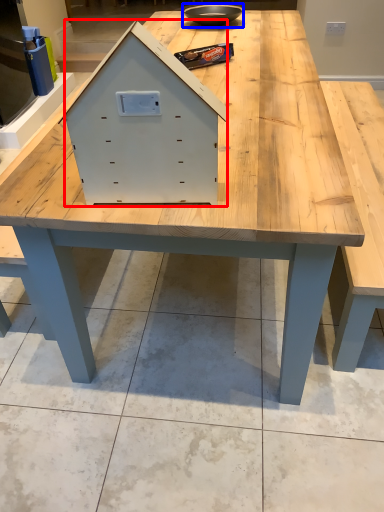
Question: Which object appears closest to the camera in this image, drawer (highlighted by a red box) or bowl (highlighted by a blue box)?

Choices:
 (A) drawer
 (B) bowl

Answer: (A)